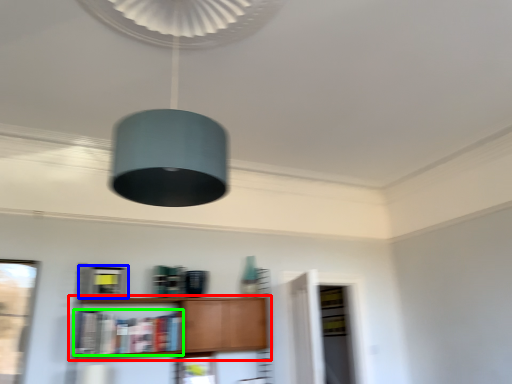
Question: Estimate the real-world distances between objects in this image. Which object is closer to shelf (highlighted by a red box), cabinetry (highlighted by a blue box) or book (highlighted by a green box)?

Choices:
 (A) cabinetry
 (B) book

Answer: (B)